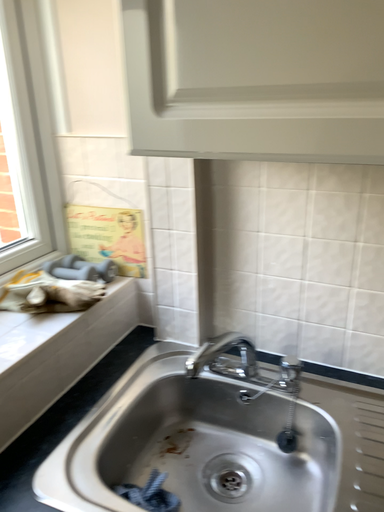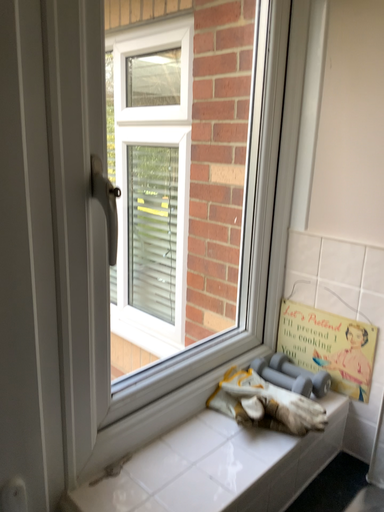
Question: How did the camera likely rotate when shooting the video?

Choices:
 (A) rotated left
 (B) rotated right

Answer: (A)